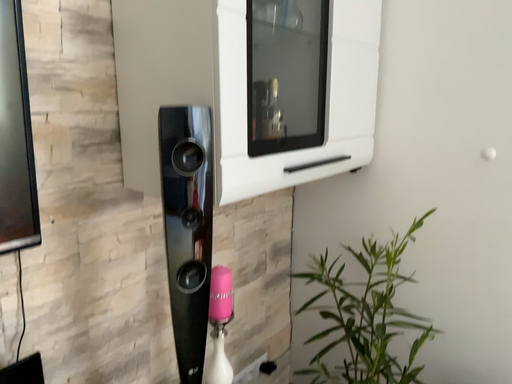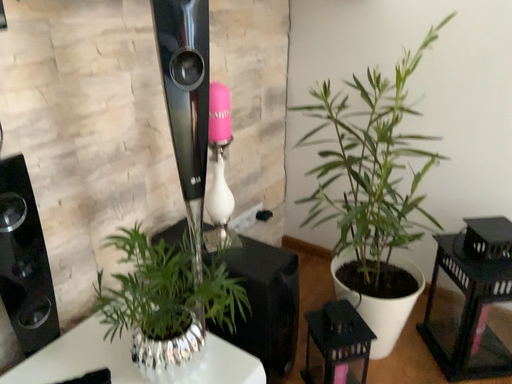
Question: How did the camera likely rotate when shooting the video?

Choices:
 (A) rotated downward
 (B) rotated upward

Answer: (A)